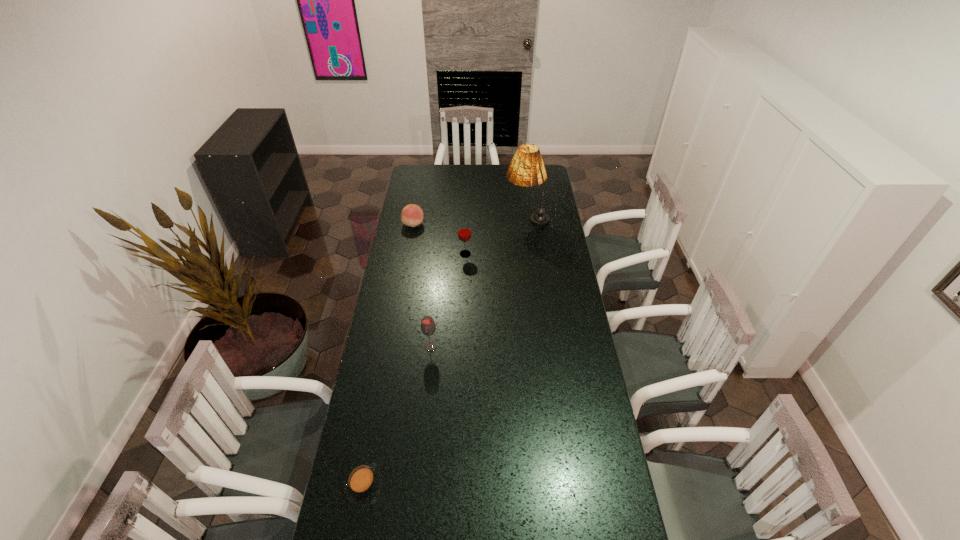
At what (x,y) coordinates should I click in order to perform the action: click on the tallest object. Please return your answer as a coordinate pair (x, y). The width and height of the screenshot is (960, 540). Looking at the image, I should click on (526, 169).

This screenshot has height=540, width=960. I want to click on lampshade, so click(526, 169).

Find the location of a particular element. Image resolution: width=960 pixels, height=540 pixels. the second object from right to left is located at coordinates (464, 229).

At what (x,y) coordinates should I click in order to perform the action: click on the right glass drink container. Please return your answer as a coordinate pair (x, y). The height and width of the screenshot is (540, 960). Looking at the image, I should click on (464, 229).

Identify the location of the second nearest object. (428, 328).

I want to click on the left glass drink container, so click(x=428, y=328).

This screenshot has height=540, width=960. Find the location of `peach`. peach is located at coordinates (412, 215).

This screenshot has height=540, width=960. What are the coordinates of `cappuccino` in the screenshot? It's located at (364, 484).

This screenshot has height=540, width=960. In order to click on the shortest object in this screenshot , I will do `click(364, 484)`.

Locate an element on the screen. The width and height of the screenshot is (960, 540). free space located on the front-facing side of the tallest object is located at coordinates (439, 218).